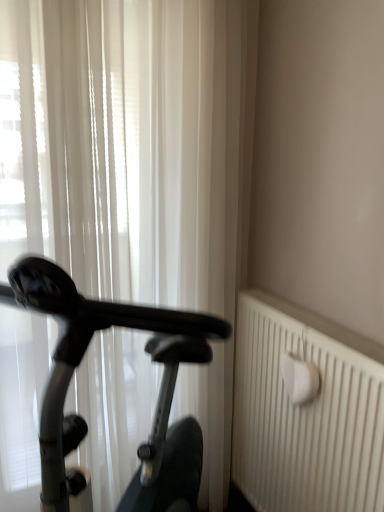
Question: Considering the relative positions of black glossy exercise bike at left and white textured radiator at right in the image provided, is black glossy exercise bike at left to the left or to the right of white textured radiator at right?

Choices:
 (A) right
 (B) left

Answer: (B)

Question: In the image, is black glossy exercise bike at left positioned in front of or behind white textured radiator at right?

Choices:
 (A) front
 (B) behind

Answer: (A)

Question: Estimate the real-world distances between objects in this image. Which object is closer to the black glossy exercise bike at left?

Choices:
 (A) white textured radiator at right
 (B) white sheer curtain at left

Answer: (A)

Question: Which object is the closest to the white sheer curtain at left?

Choices:
 (A) black glossy exercise bike at left
 (B) white textured radiator at right

Answer: (A)